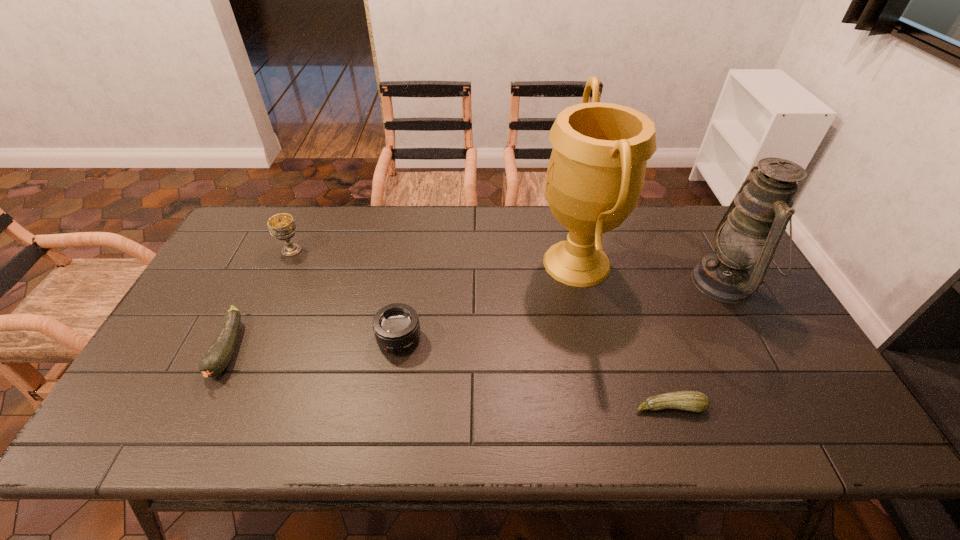
Locate an element on the screen. vacant space in between the fourth shortest object and the fifth shortest object is located at coordinates (509, 266).

This screenshot has height=540, width=960. Identify the location of vacant space that is in between the tallest object and the shortest object. point(623,335).

Find the location of a particular element. The image size is (960, 540). free spot between the telephoto lens and the taller zucchini is located at coordinates (314, 345).

You are a GUI agent. You are given a task and a screenshot of the screen. Output one action in this format:
    pyautogui.click(x=<x>, y=<y>)
    Task: Click on the vacant area that lies between the fourth object from right to left and the trophy
    
    Given the screenshot: What is the action you would take?
    pyautogui.click(x=488, y=301)

Find the location of `vacant area that lies between the fifth tallest object and the chalice`. vacant area that lies between the fifth tallest object and the chalice is located at coordinates (260, 300).

This screenshot has height=540, width=960. In order to click on object that is the third closest one to the fourth shortest object in this screenshot , I will do click(x=596, y=172).

Locate an element on the screen. The height and width of the screenshot is (540, 960). object that is the second closest to the farther zucchini is located at coordinates (396, 327).

Where is `vacant region that satisfies the following two spatial constraints: 1. on the front side of the chalice; 2. on the right side of the rightmost object`? This screenshot has height=540, width=960. vacant region that satisfies the following two spatial constraints: 1. on the front side of the chalice; 2. on the right side of the rightmost object is located at coordinates (277, 282).

Find the location of `free location that satisfies the following two spatial constraints: 1. on the engravings side of the fifth shortest object; 2. on the right side of the tallest object`. free location that satisfies the following two spatial constraints: 1. on the engravings side of the fifth shortest object; 2. on the right side of the tallest object is located at coordinates (581, 282).

At what (x,y) coordinates should I click in order to perform the action: click on vacant space that satisfies the following two spatial constraints: 1. on the engravings side of the tallest object; 2. on the back side of the rightmost object. Please return your answer as a coordinate pair (x, y). This screenshot has height=540, width=960. Looking at the image, I should click on (581, 282).